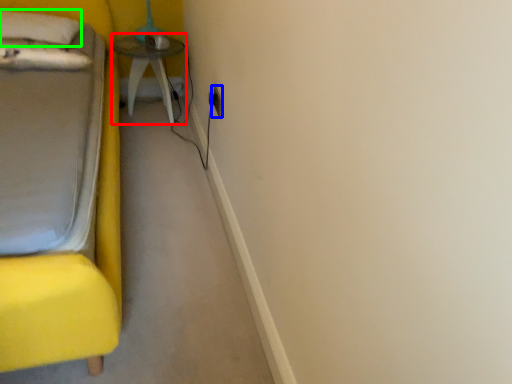
Question: Estimate the real-world distances between objects in this image. Which object is farther from table (highlighted by a red box), electric outlet (highlighted by a blue box) or pillow (highlighted by a green box)?

Choices:
 (A) electric outlet
 (B) pillow

Answer: (A)